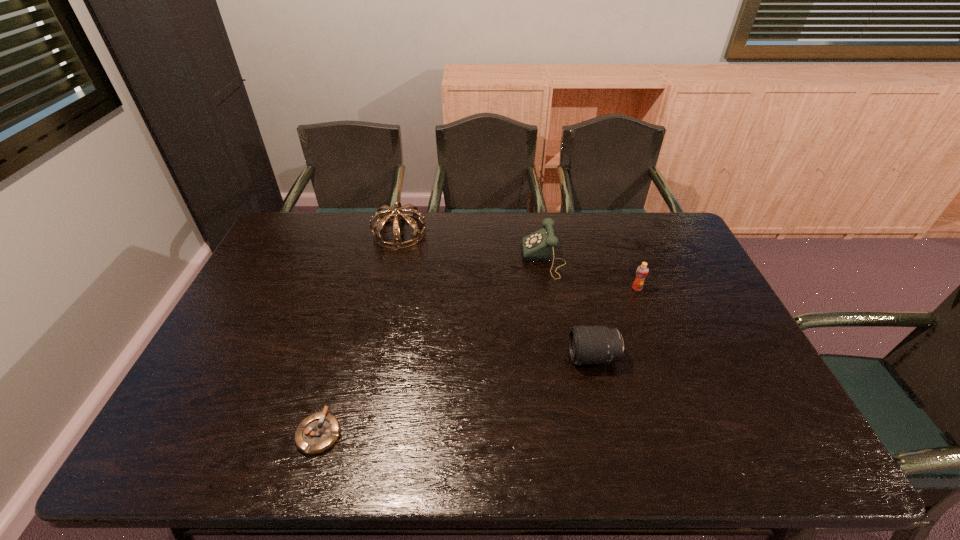
Locate an element on the screen. The image size is (960, 540). the tallest object is located at coordinates (413, 219).

Where is `orange juice`? orange juice is located at coordinates (642, 271).

Identify the location of the third nearest object. Image resolution: width=960 pixels, height=540 pixels. (642, 271).

Find the location of `telephone`. telephone is located at coordinates (539, 246).

Find the location of a particular element. the fourth farthest object is located at coordinates (589, 345).

Identify the location of ashtray. The height and width of the screenshot is (540, 960). (317, 433).

At what (x,y) coordinates should I click in order to perform the action: click on the shortest object. Please return your answer as a coordinate pair (x, y). Looking at the image, I should click on (317, 433).

Locate an element on the screen. The image size is (960, 540). vacant area situated on the right of the tiara is located at coordinates (493, 233).

You are a GUI agent. You are given a task and a screenshot of the screen. Output one action in this format:
    pyautogui.click(x=<x>, y=<y>)
    Task: Click on the vacant space situated on the left of the orange juice
    
    Given the screenshot: What is the action you would take?
    pyautogui.click(x=532, y=288)

You are a GUI agent. You are given a task and a screenshot of the screen. Output one action in this format:
    pyautogui.click(x=<x>, y=<y>)
    Task: Click on the blank space located on the dial of the telephone
    This screenshot has height=540, width=960.
    Given the screenshot: What is the action you would take?
    pyautogui.click(x=454, y=259)